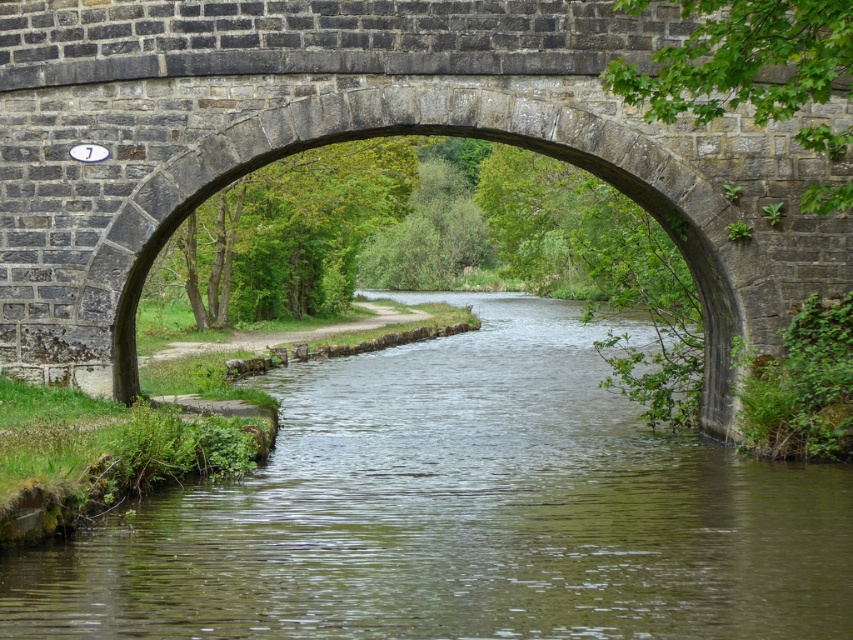
How far apart are green smooth water at center and stone arch bridge at center?

A distance of 17.85 feet exists between green smooth water at center and stone arch bridge at center.

You are a GUI agent. You are given a task and a screenshot of the screen. Output one action in this format:
    pyautogui.click(x=<x>, y=<y>)
    Task: Click on the green smooth water at center
    
    Given the screenshot: What is the action you would take?
    pyautogui.click(x=462, y=513)

Is point (306, 573) closer to camera compared to point (708, 248)?

Yes, point (306, 573) is in front of point (708, 248).

Identify the location of green smooth water at center. (462, 513).